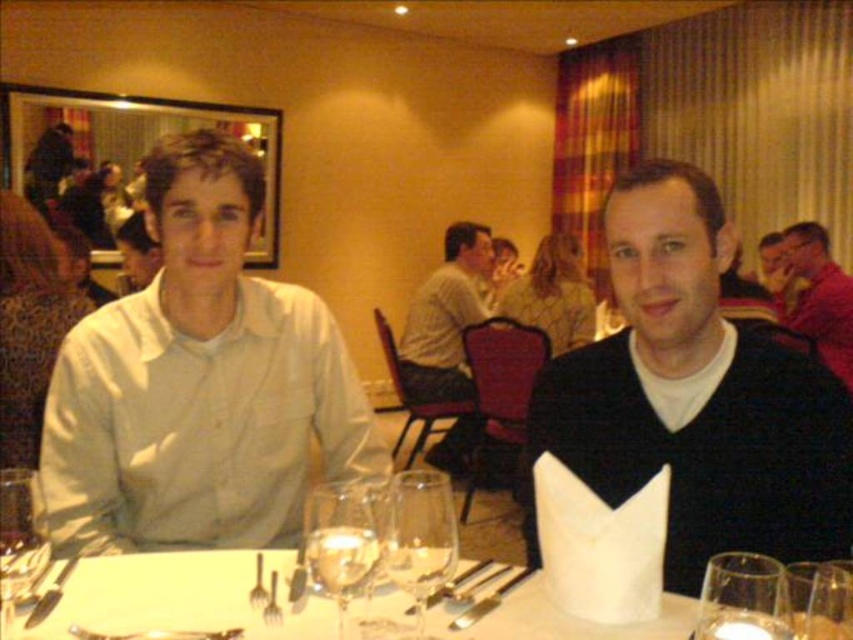
You are a photographer standing at the entrance of the dining area. You want to take a photo of the black matte sweater at center. Where should you position your camera to capture the sweater in the frame?

Result: To capture the black matte sweater at center in the frame, position your camera so that it points towards the coordinates approximately at point 0.620 on the horizontal axis and 0.815 on the vertical axis.

You are a waiter in a restaurant. You need to place a new wine glass on the table without disturbing the existing setup. The white cotton shirt at left is currently above the transparent glass wine glass at center. Where should you place the new glass to avoid it?

The white cotton shirt at left is located above the transparent glass wine glass at center, so you should place the new glass somewhere below or to the sides of the transparent glass wine glass at center to avoid placing it under the shirt.

You are a waiter at this table and need to reach the shiny metallic fork at lower center to clear it. However, the black matte sweater at center is in your way. Can you move the sweater to access the fork?

The shiny metallic fork at lower center is behind the black matte sweater at center, so you would need to move the black matte sweater at center to access the fork.